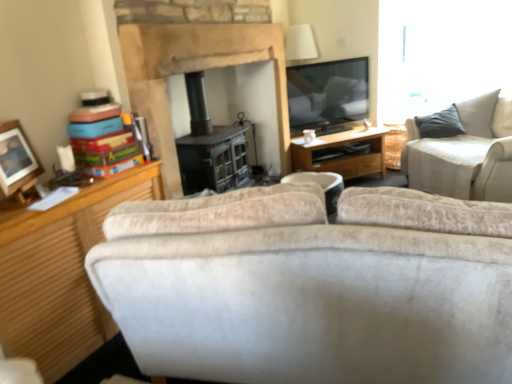
Question: From a real-world perspective, is wooden photo frame at left on white fabric trash bin/can at center?

Choices:
 (A) no
 (B) yes

Answer: (B)

Question: Can you confirm if wooden photo frame at left is taller than white fabric trash bin/can at center?

Choices:
 (A) yes
 (B) no

Answer: (A)

Question: Is wooden photo frame at left outside white fabric trash bin/can at center?

Choices:
 (A) yes
 (B) no

Answer: (A)

Question: Is white fabric trash bin/can at center at the back of wooden photo frame at left?

Choices:
 (A) no
 (B) yes

Answer: (A)

Question: Considering the relative positions of wooden photo frame at left and white fabric trash bin/can at center in the image provided, is wooden photo frame at left behind white fabric trash bin/can at center?

Choices:
 (A) yes
 (B) no

Answer: (B)

Question: Is wooden photo frame at left bigger than white fabric trash bin/can at center?

Choices:
 (A) yes
 (B) no

Answer: (B)

Question: Is wooden photo frame at left a part of beige fabric couch at upper right?

Choices:
 (A) no
 (B) yes

Answer: (A)

Question: From a real-world perspective, is beige fabric couch at upper right under wooden photo frame at left?

Choices:
 (A) yes
 (B) no

Answer: (A)

Question: Is the depth of beige fabric couch at upper right less than that of wooden photo frame at left?

Choices:
 (A) yes
 (B) no

Answer: (B)

Question: Is beige fabric couch at upper right aimed at wooden photo frame at left?

Choices:
 (A) no
 (B) yes

Answer: (B)

Question: Is beige fabric couch at upper right taller than wooden photo frame at left?

Choices:
 (A) yes
 (B) no

Answer: (A)

Question: Does beige fabric couch at upper right appear on the right side of wooden photo frame at left?

Choices:
 (A) yes
 (B) no

Answer: (A)

Question: Does wooden desk at center turn towards white ceramic coffee cup at center?

Choices:
 (A) no
 (B) yes

Answer: (A)